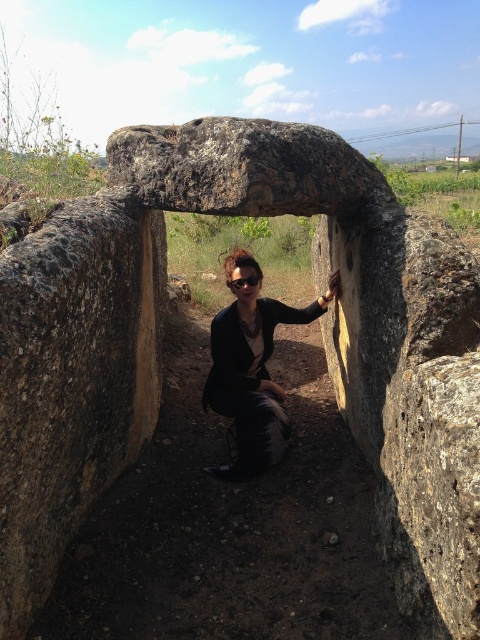
Question: Is matte black jacket at center further to the viewer compared to black matte goggles at center?

Choices:
 (A) yes
 (B) no

Answer: (B)

Question: Is matte black jacket at center thinner than black matte goggles at center?

Choices:
 (A) yes
 (B) no

Answer: (B)

Question: Which point is closer to the camera?

Choices:
 (A) black matte goggles at center
 (B) matte black jacket at center

Answer: (B)

Question: Among these objects, which one is nearest to the camera?

Choices:
 (A) matte black jacket at center
 (B) black matte goggles at center

Answer: (A)

Question: Does matte black jacket at center have a greater width compared to black matte goggles at center?

Choices:
 (A) yes
 (B) no

Answer: (A)